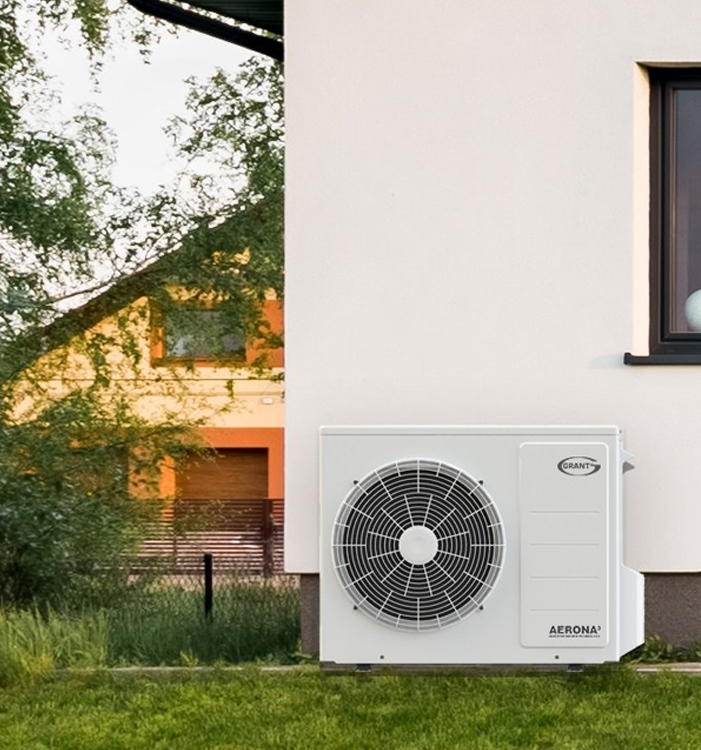
I want to click on fan, so click(x=404, y=585).